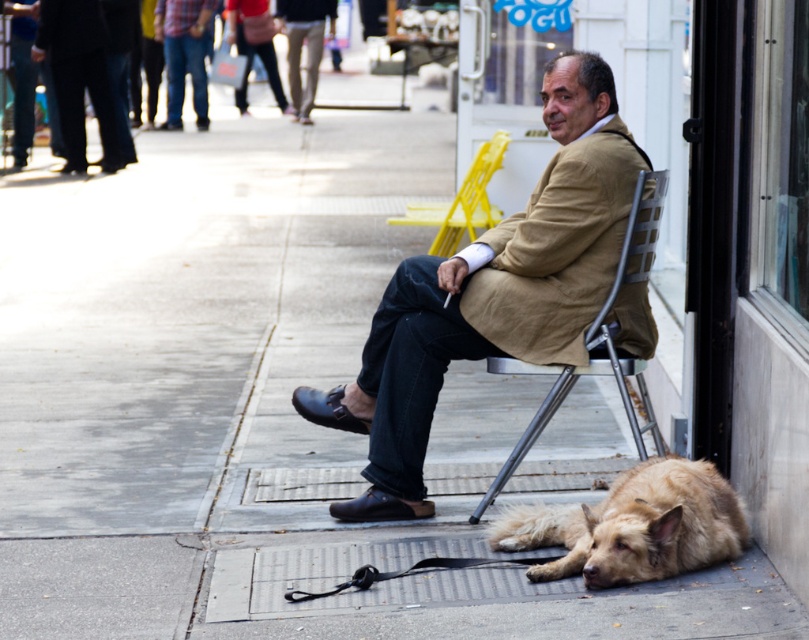
You are a delivery person who needs to place a small package between the fuzzy brown fur at lower right and the yellow plastic chair at center. Can you fit the package there?

The fuzzy brown fur at lower right is wider than the yellow plastic chair at center, so there is enough space between them to place the small package.

You are a passerby who wants to sit on the metallic silver folding chair at center. Is the brown leather jacket at center currently occupying it?

The brown leather jacket at center is positioned over metallic silver folding chair at center, so yes, the jacket is occupying the chair.